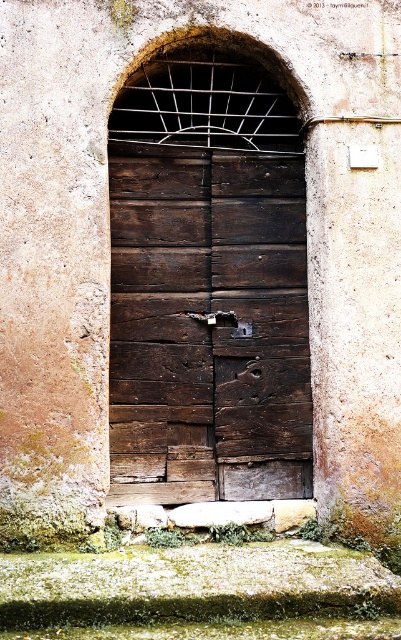
Question: Which object appears farthest from the camera in this image?

Choices:
 (A) dark wood door at center
 (B) metallic dark brown lock at center

Answer: (B)

Question: In this image, where is dark wood door at center located relative to metallic dark brown lock at center?

Choices:
 (A) below
 (B) above

Answer: (B)

Question: Is dark wood door at center below metallic dark brown lock at center?

Choices:
 (A) no
 (B) yes

Answer: (A)

Question: Can you confirm if dark wood door at center is positioned below metallic dark brown lock at center?

Choices:
 (A) no
 (B) yes

Answer: (A)

Question: Which object appears closest to the camera in this image?

Choices:
 (A) dark wood door at center
 (B) metallic dark brown lock at center

Answer: (A)